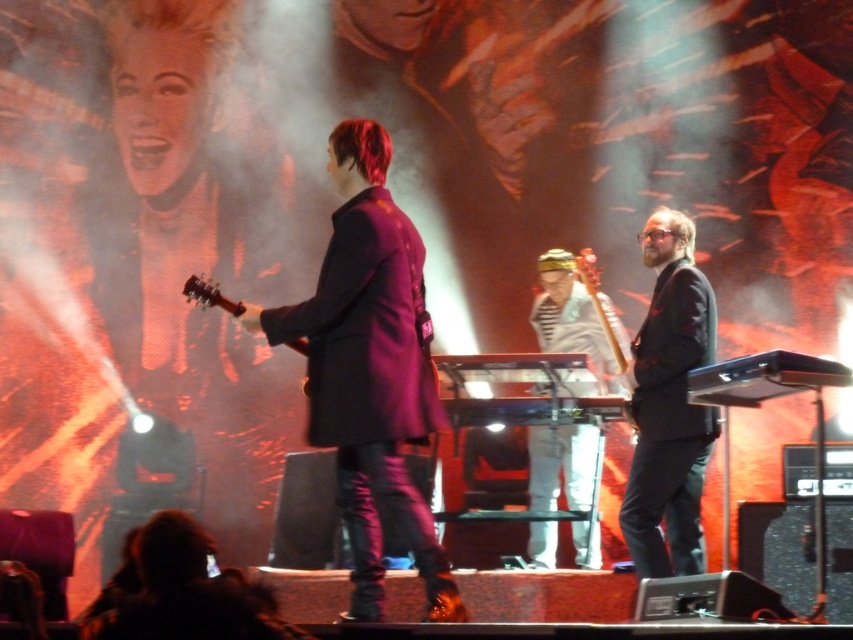
Question: Is purple matte coat at center to the left of black matte suit at right from the viewer's perspective?

Choices:
 (A) no
 (B) yes

Answer: (B)

Question: Which point appears farthest from the camera in this image?

Choices:
 (A) (383, 440)
 (B) (669, 387)
 (C) (572, 284)

Answer: (C)

Question: Which object is farther from the camera taking this photo?

Choices:
 (A) white striped shirt at center
 (B) black matte suit at right

Answer: (A)

Question: Among these points, which one is farthest from the camera?

Choices:
 (A) (543, 269)
 (B) (259, 328)

Answer: (A)

Question: Is black matte suit at right to the left of white striped shirt at center from the viewer's perspective?

Choices:
 (A) yes
 (B) no

Answer: (B)

Question: Does purple matte coat at center appear over white striped shirt at center?

Choices:
 (A) no
 (B) yes

Answer: (B)